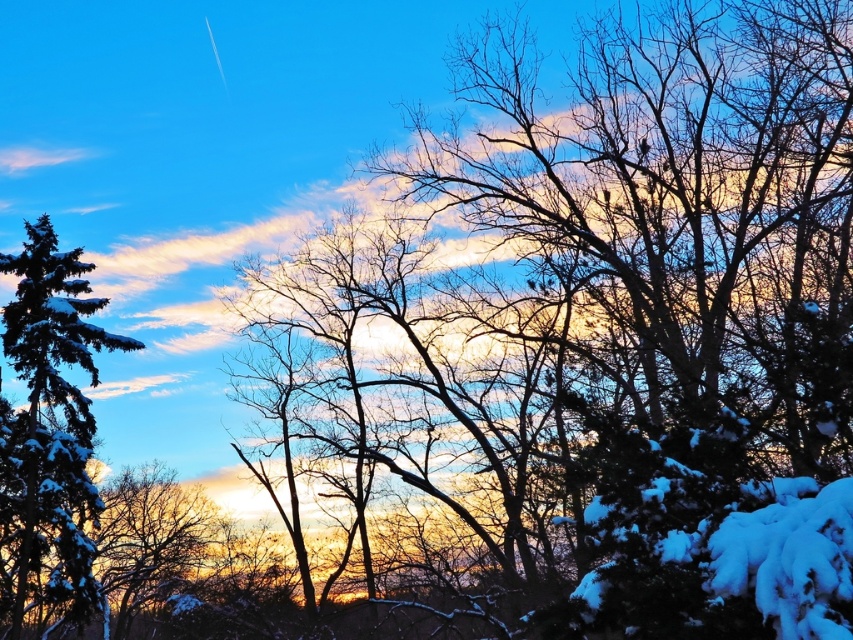
Question: Does snow-covered evergreen at left have a lesser width compared to snow-covered branches at center?

Choices:
 (A) yes
 (B) no

Answer: (B)

Question: Among these objects, which one is farthest from the camera?

Choices:
 (A) snow-covered branches at center
 (B) snow-covered evergreen at left

Answer: (A)

Question: Is the position of snow-covered evergreen at left less distant than that of snow-covered branches at center?

Choices:
 (A) no
 (B) yes

Answer: (B)

Question: Is snow-covered evergreen at left bigger than snow-covered branches at center?

Choices:
 (A) yes
 (B) no

Answer: (A)